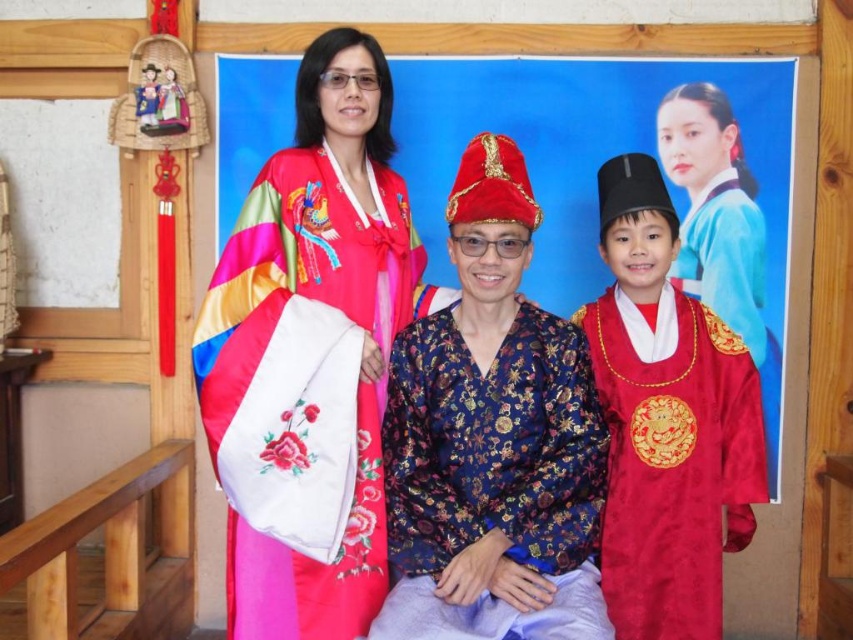
Is the position of silky satin hanbok at center less distant than that of silky blue robe at upper right?

Yes, it is.

Does point (331, 596) lie in front of point (695, 237)?

Yes, it is in front of point (695, 237).

This screenshot has height=640, width=853. I want to click on silky satin hanbok at center, so click(x=302, y=317).

Which of these two, silky satin hanbok at center or silky red robe at center, stands taller?

silky satin hanbok at center is taller.

Which is behind, point (228, 570) or point (646, 490)?

The point (228, 570) is more distant.

Find the location of a particular element. This screenshot has width=853, height=640. silky satin hanbok at center is located at coordinates (302, 317).

At what (x,y) coordinates should I click in order to perform the action: click on silky satin hanbok at center. Please return your answer as a coordinate pair (x, y). This screenshot has height=640, width=853. Looking at the image, I should click on (302, 317).

Which is below, silky red robe at center or silky blue robe at upper right?

silky red robe at center

Does silky red robe at center have a lesser width compared to silky blue robe at upper right?

Incorrect, silky red robe at center's width is not less than silky blue robe at upper right's.

Who is more distant from viewer, (718, 497) or (724, 193)?

The point (724, 193) is behind.

At what (x,y) coordinates should I click in order to perform the action: click on silky red robe at center. Please return your answer as a coordinate pair (x, y). The image size is (853, 640). Looking at the image, I should click on (666, 420).